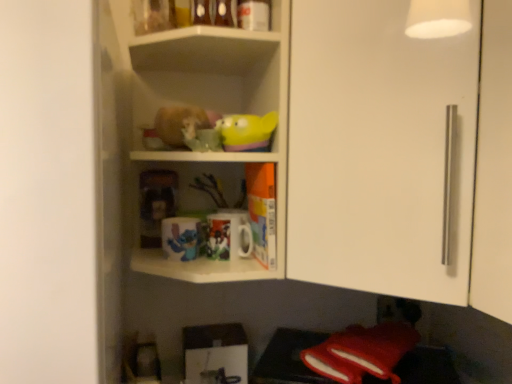
What do you see at coordinates (181, 238) in the screenshot?
I see `glossy ceramic mug at upper center, arranged as the second mug when viewed from the right` at bounding box center [181, 238].

Consider the image. Measure the distance between point (180, 128) and camera.

The distance of point (180, 128) from camera is 32.44 inches.

The height and width of the screenshot is (384, 512). I want to click on matte plastic toy at center, which is counted as the 2th toy, starting from the top, so click(x=158, y=194).

This screenshot has width=512, height=384. What do you see at coordinates (229, 236) in the screenshot?
I see `matte ceramic mug at center, which is the first mug in right-to-left order` at bounding box center [229, 236].

Where is `glossy ceramic mug at upper center, arranged as the second mug when viewed from the right`? The height and width of the screenshot is (384, 512). glossy ceramic mug at upper center, arranged as the second mug when viewed from the right is located at coordinates (181, 238).

From the image's perspective, who appears lower, white glossy shelves at upper center or white glossy cabinet door at upper right?

white glossy shelves at upper center is shown below in the image.

Consider the image. How far apart are white glossy shelves at upper center and white glossy cabinet door at upper right?

white glossy shelves at upper center is 8.10 inches from white glossy cabinet door at upper right.

In terms of height, does white glossy shelves at upper center look taller or shorter compared to white glossy cabinet door at upper right?

white glossy shelves at upper center is shorter than white glossy cabinet door at upper right.

Who is more distant, white glossy shelves at upper center or white glossy cabinet door at upper right?

white glossy shelves at upper center is further away from the camera.

Between white glossy cabinet door at upper right and rubber duck at upper center, which is the 2th toy from bottom to top, which one appears on the left side from the viewer's perspective?

Positioned to the left is rubber duck at upper center, which is the 2th toy from bottom to top.

Considering their positions, is white glossy cabinet door at upper right located in front of or behind rubber duck at upper center, which is the 2th toy from bottom to top?

white glossy cabinet door at upper right is in front of rubber duck at upper center, which is the 2th toy from bottom to top.

Does white glossy cabinet door at upper right contain rubber duck at upper center, the 1th toy positioned from the top?

No, rubber duck at upper center, the 1th toy positioned from the top, is not inside white glossy cabinet door at upper right.

Considering the relative sizes of white glossy cabinet door at upper right and rubber duck at upper center, the 1th toy positioned from the top, in the image provided, is white glossy cabinet door at upper right thinner than rubber duck at upper center, the 1th toy positioned from the top,?

Incorrect, the width of white glossy cabinet door at upper right is not less than that of rubber duck at upper center, the 1th toy positioned from the top.

Is white glossy cabinet door at upper right a part of glossy ceramic mug at upper center, placed as the first mug when sorted from left to right?

No, white glossy cabinet door at upper right is located outside of glossy ceramic mug at upper center, placed as the first mug when sorted from left to right.

Between glossy ceramic mug at upper center, arranged as the second mug when viewed from the right, and white glossy cabinet door at upper right, which one has larger width?

white glossy cabinet door at upper right.

In the image, there is a glossy ceramic mug at upper center, arranged as the second mug when viewed from the right. At what (x,y) coordinates should I click in order to perform the action: click on glass door above it (from the image's perspective). Please return your answer as a coordinate pair (x, y). The width and height of the screenshot is (512, 384). Looking at the image, I should click on (379, 150).

Is glossy ceramic mug at upper center, arranged as the second mug when viewed from the right, bigger or smaller than white glossy cabinet door at upper right?

In the image, glossy ceramic mug at upper center, arranged as the second mug when viewed from the right, appears to be smaller than white glossy cabinet door at upper right.

What's the angular difference between glossy ceramic mug at upper center, placed as the first mug when sorted from left to right, and rubber duck at upper center, the 1th toy positioned from the top,'s facing directions?

7.62 degrees.

Is glossy ceramic mug at upper center, arranged as the second mug when viewed from the right, positioned before rubber duck at upper center, which is the 2th toy from bottom to top?

No, glossy ceramic mug at upper center, arranged as the second mug when viewed from the right, is further to the viewer.

In the scene shown: In terms of size, does glossy ceramic mug at upper center, placed as the first mug when sorted from left to right, appear bigger or smaller than rubber duck at upper center, which ranks as the 1th toy in front-to-back order?

glossy ceramic mug at upper center, placed as the first mug when sorted from left to right, is smaller than rubber duck at upper center, which ranks as the 1th toy in front-to-back order.

Is glossy ceramic mug at upper center, arranged as the second mug when viewed from the right, at the right side of rubber duck at upper center, acting as the first toy starting from the right?

No, glossy ceramic mug at upper center, arranged as the second mug when viewed from the right, is not to the right of rubber duck at upper center, acting as the first toy starting from the right.

Can you confirm if matte plastic toy at center, the 1th toy when ordered from back to front, is positioned to the left of matte ceramic mug at center, acting as the 2th mug starting from the left?

Indeed, matte plastic toy at center, the 1th toy when ordered from back to front, is positioned on the left side of matte ceramic mug at center, acting as the 2th mug starting from the left.

Image resolution: width=512 pixels, height=384 pixels. Identify the location of mug that is the 2nd one when counting rightward from the matte plastic toy at center, which is counted as the 2th toy, starting from the top. (229, 236).

Is matte plastic toy at center, the 1th toy ordered from the bottom, next to matte ceramic mug at center, which is the first mug in right-to-left order?

No, matte plastic toy at center, the 1th toy ordered from the bottom, is not with matte ceramic mug at center, which is the first mug in right-to-left order.

Is matte plastic toy at center, which appears as the 2th toy when viewed from the front, smaller than matte ceramic mug at center, which is the first mug in right-to-left order?

Incorrect, matte plastic toy at center, which appears as the 2th toy when viewed from the front, is not smaller in size than matte ceramic mug at center, which is the first mug in right-to-left order.

Is glossy ceramic mug at upper center, arranged as the second mug when viewed from the right, at the back of white glossy cabinet door at upper right?

white glossy cabinet door at upper right does not have its back to glossy ceramic mug at upper center, arranged as the second mug when viewed from the right.

From a real-world perspective, is white glossy cabinet door at upper right positioned over glossy ceramic mug at upper center, arranged as the second mug when viewed from the right, based on gravity?

Indeed, from a real-world perspective, white glossy cabinet door at upper right stands above glossy ceramic mug at upper center, arranged as the second mug when viewed from the right.

Does point (358, 239) come farther from viewer compared to point (172, 222)?

No, (358, 239) is in front of (172, 222).

Can you tell me how much white glossy cabinet door at upper right and glossy ceramic mug at upper center, arranged as the second mug when viewed from the right, differ in facing direction?

The angular difference between white glossy cabinet door at upper right and glossy ceramic mug at upper center, arranged as the second mug when viewed from the right, is 34.9 degrees.

From a real-world perspective, does fuzzy fabric hamster at center sit lower than white glossy shelves at upper center?

Correct, in the physical world, fuzzy fabric hamster at center is lower than white glossy shelves at upper center.

Considering the positions of point (161, 119) and point (206, 52), is point (161, 119) closer or farther from the camera than point (206, 52)?

Point (161, 119) appears to be closer to the viewer than point (206, 52).

Is fuzzy fabric hamster at center positioned far away from white glossy shelves at upper center?

fuzzy fabric hamster at center is near white glossy shelves at upper center, not far away.

You are a GUI agent. You are given a task and a screenshot of the screen. Output one action in this format:
    pyautogui.click(x=<x>, y=<y>)
    Task: Click on the glass door that is on the right side of white glossy shelves at upper center
    
    Given the screenshot: What is the action you would take?
    pyautogui.click(x=379, y=150)

Starting from the white glossy cabinet door at upper right, which toy is the 1st one behind? Please provide its 2D coordinates.

[(247, 132)]

From the image, which object appears to be nearer to glossy ceramic mug at upper center, placed as the first mug when sorted from left to right, matte plastic toy at center, which ranks as the second toy in right-to-left order, or white glossy cabinet door at upper right?

matte plastic toy at center, which ranks as the second toy in right-to-left order, is positioned closer to the anchor glossy ceramic mug at upper center, placed as the first mug when sorted from left to right.

Based on their spatial positions, is white glossy shelves at upper center or matte ceramic mug at center, which is the first mug in right-to-left order, closer to fuzzy fabric hamster at center?

The object closer to fuzzy fabric hamster at center is white glossy shelves at upper center.

Based on their spatial positions, is white glossy cabinet door at upper right or rubber duck at upper center, the 1th toy positioned from the top, further from white glossy shelves at upper center?

white glossy cabinet door at upper right lies further to white glossy shelves at upper center than the other object.

Considering their positions, is matte plastic toy at center, which is counted as the 2th toy, starting from the top, positioned further to rubber duck at upper center, the 2th toy from the back, than white glossy cabinet door at upper right?

matte plastic toy at center, which is counted as the 2th toy, starting from the top.

When comparing their distances from rubber duck at upper center, the second toy from the left, does matte ceramic mug at center, acting as the 2th mug starting from the left, or white glossy cabinet door at upper right seem closer?

matte ceramic mug at center, acting as the 2th mug starting from the left, lies closer to rubber duck at upper center, the second toy from the left, than the other object.

Which object lies nearer to the anchor point matte ceramic mug at center, which is the first mug in right-to-left order, glossy ceramic mug at upper center, placed as the first mug when sorted from left to right, or white glossy cabinet door at upper right?

Based on the image, glossy ceramic mug at upper center, placed as the first mug when sorted from left to right, appears to be nearer to matte ceramic mug at center, which is the first mug in right-to-left order.

When comparing their distances from glossy ceramic mug at upper center, arranged as the second mug when viewed from the right, does white glossy shelves at upper center or rubber duck at upper center, which is the 2th toy from bottom to top, seem closer?

rubber duck at upper center, which is the 2th toy from bottom to top, is positioned closer to the anchor glossy ceramic mug at upper center, arranged as the second mug when viewed from the right.

In the scene shown: Looking at the image, which one is located closer to matte plastic toy at center, which ranks as the second toy in right-to-left order, rubber duck at upper center, the 2th toy from the back, or fuzzy fabric hamster at center?

Based on the image, fuzzy fabric hamster at center appears to be nearer to matte plastic toy at center, which ranks as the second toy in right-to-left order.

Locate an element on the screen. Image resolution: width=512 pixels, height=384 pixels. toy between white glossy shelves at upper center and matte plastic toy at center, which appears as the 2th toy when viewed from the front, along the z-axis is located at coordinates (247, 132).

At what (x,y) coordinates should I click in order to perform the action: click on stuff between glossy ceramic mug at upper center, placed as the first mug when sorted from left to right, and white glossy cabinet door at upper right from left to right. Please return your answer as a coordinate pair (x, y). Looking at the image, I should click on (180, 124).

This screenshot has height=384, width=512. Find the location of `shelf between fuzzy fabric hamster at center and white glossy cabinet door at upper right in the horizontal direction`. shelf between fuzzy fabric hamster at center and white glossy cabinet door at upper right in the horizontal direction is located at coordinates (220, 109).

Locate an element on the screen. mug between white glossy shelves at upper center and white glossy cabinet door at upper right in the horizontal direction is located at coordinates (229, 236).